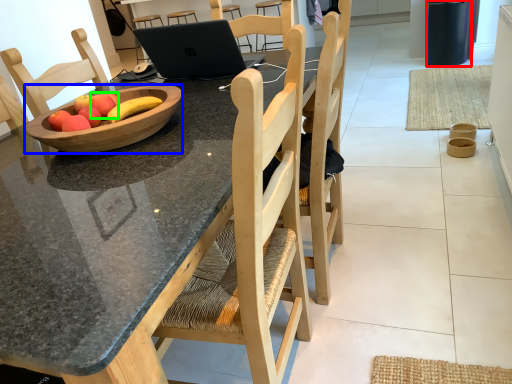
Question: Considering the real-world distances, which object is closest to trash bin/can (highlighted by a red box)? bowl (highlighted by a blue box) or apple (highlighted by a green box).

Choices:
 (A) bowl
 (B) apple

Answer: (A)